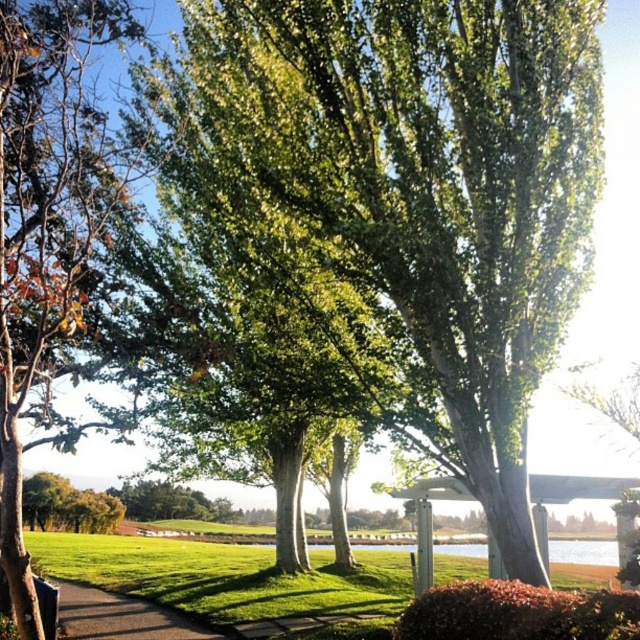
You are standing at the base of the tall trees in the foreground and want to walk towards the water in the midground. There are two points marked on the path you need to pass through. Which point should you reach first, point (561,132) or point (122,605)?

You should reach point (561,132) first because it is in front of point (122,605) along your path towards the water.

From the picture: You are planning to plant a new tree in your backyard and want to ensure it has enough space to grow. You see the green leafy tree at center and the brown asphalt path at lower left in the image. Which object is taller and therefore requires more vertical space for planting?

The green leafy tree at center is much taller than the brown asphalt path at lower left, so it requires more vertical space for planting.